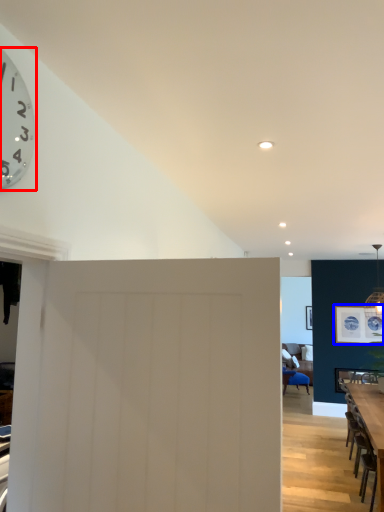
Question: Which object is further to the camera taking this photo, wall clock (highlighted by a red box) or picture frame (highlighted by a blue box)?

Choices:
 (A) wall clock
 (B) picture frame

Answer: (B)